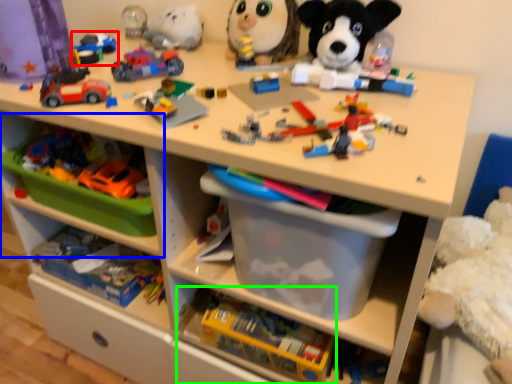
Question: Considering the real-world distances, which object is closest to toy (highlighted by a red box)? shelf (highlighted by a blue box) or toy (highlighted by a green box).

Choices:
 (A) shelf
 (B) toy

Answer: (A)